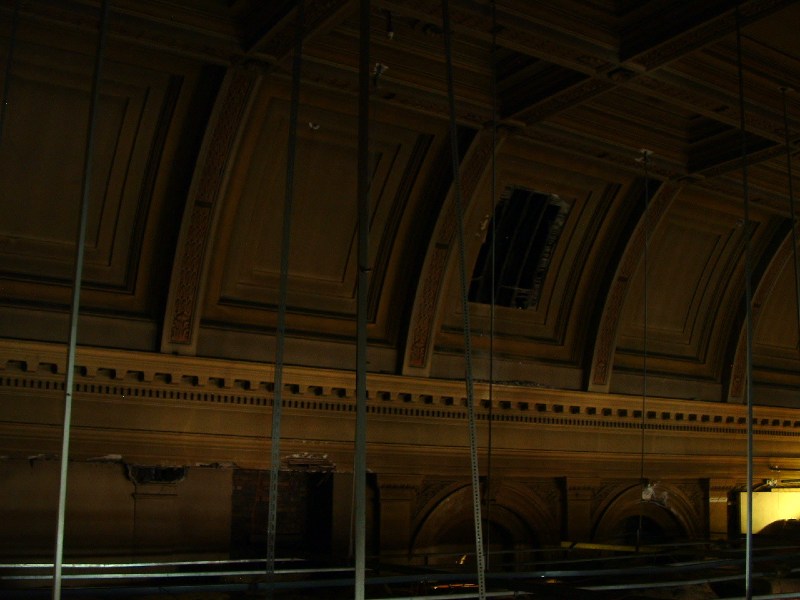
Find the location of a particular element. This screenshot has height=600, width=800. area where steel pole attaches to the ceiling is located at coordinates (646, 155).